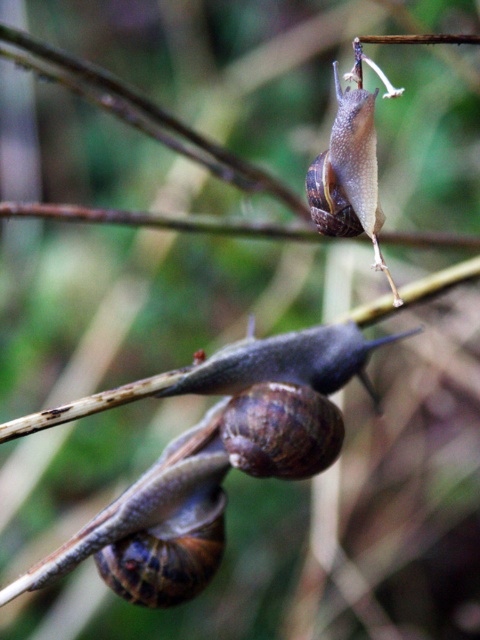
You are a gardener observing two snails on a plant stem. You see the brown textured snail at center and the shiny brown snail at upper center. Which snail is positioned higher on the stem?

The shiny brown snail at upper center is positioned higher on the stem than the brown textured snail at center.

Based on the photo, you are a photographer trying to capture a closeup of both snails. You notice two points marked in the image, point 1 at coordinates point (x=48, y=557) and point 2 at coordinates point (x=348, y=188). Which point should you focus on to ensure the snail that is closer to you is in sharp focus?

Point 1 at coordinates point (x=48, y=557) should be focused on because it is closer to the camera than point (x=348, y=188), ensuring the snail at that point is in sharp focus.

You are a photographer aiming to capture a closeup of the brown textured snail at center. Based on its position in the image, where should you focus your camera to ensure the snail is in sharp focus?

To ensure the brown textured snail at center is in sharp focus, you should focus your camera at the 2D coordinate point of (210, 458) where the snail is located.